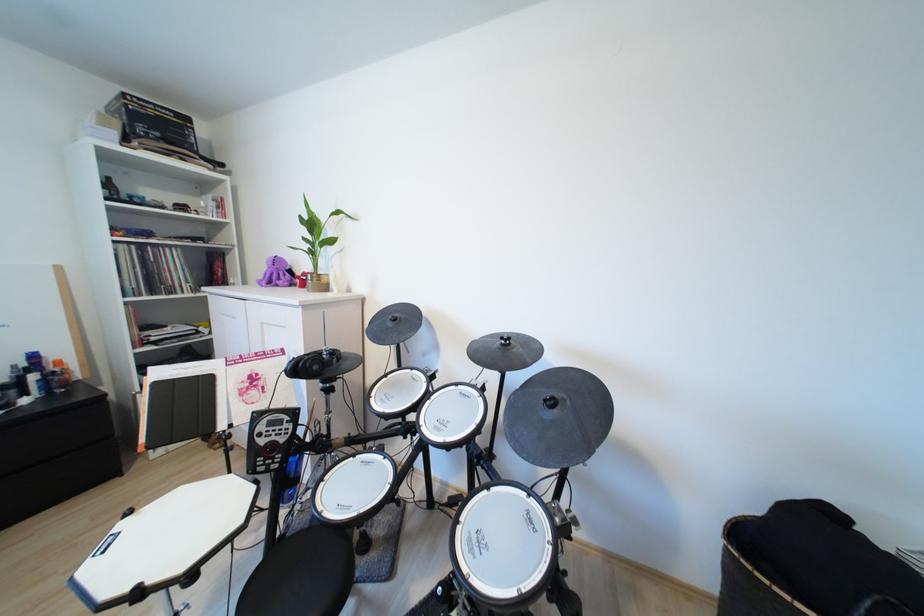
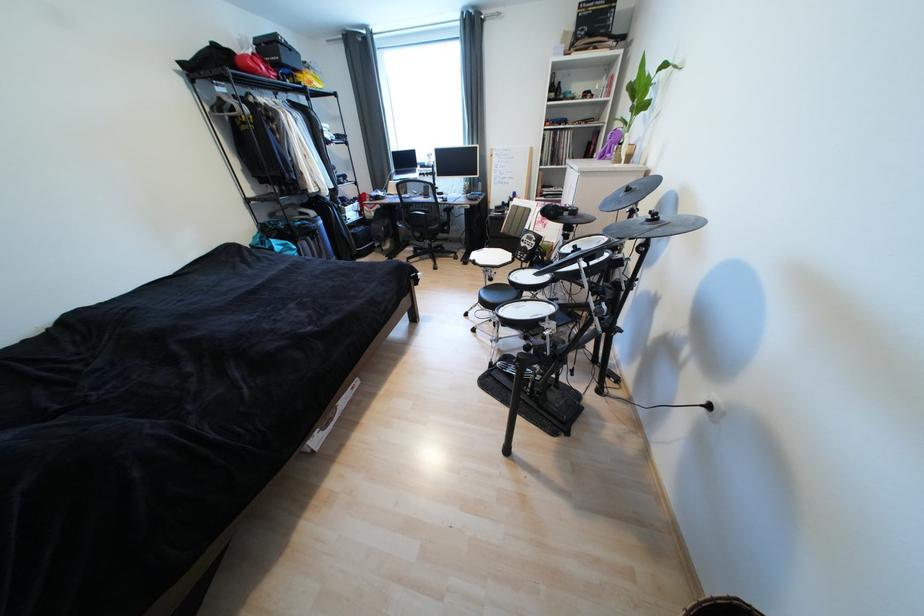
Question: I am providing you with two images of the same scene from different viewpoints. Please identify which objects are invisible in image2.

Choices:
 (A) small dark bottle
 (B) paper brochure
 (C) woven basket
 (D) chair sitting surface

Answer: (D)